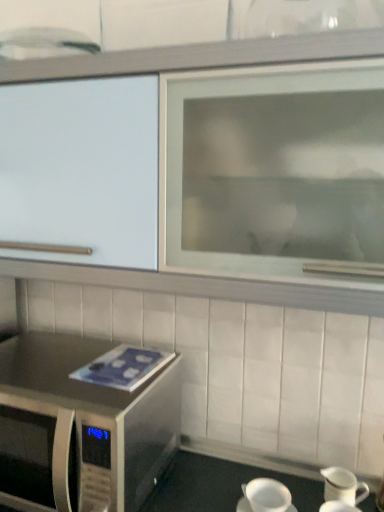
Question: Could white glossy pitcher at lower right, positioned as the second tableware in front-to-back order, be considered to be inside white glossy cabinet at upper center?

Choices:
 (A) yes
 (B) no

Answer: (B)

Question: Does white glossy cabinet at upper center have a larger size compared to white glossy pitcher at lower right, arranged as the 1th tableware when viewed from the back?

Choices:
 (A) yes
 (B) no

Answer: (A)

Question: Considering the relative sizes of white glossy cabinet at upper center and white glossy pitcher at lower right, arranged as the 1th tableware when viewed from the back, in the image provided, is white glossy cabinet at upper center wider than white glossy pitcher at lower right, arranged as the 1th tableware when viewed from the back,?

Choices:
 (A) no
 (B) yes

Answer: (B)

Question: From a real-world perspective, is white glossy cabinet at upper center located higher than white glossy pitcher at lower right, arranged as the 1th tableware when viewed from the back?

Choices:
 (A) yes
 (B) no

Answer: (A)

Question: Would you say white glossy cabinet at upper center is a long distance from white glossy pitcher at lower right, arranged as the 1th tableware when viewed from the back?

Choices:
 (A) no
 (B) yes

Answer: (A)

Question: Looking at the image, does white matte coffee cup at lower center seem bigger or smaller compared to white glossy pitcher at lower right, the 1th tableware positioned from the front?

Choices:
 (A) big
 (B) small

Answer: (B)

Question: Looking at their shapes, would you say white matte coffee cup at lower center is wider or thinner than white glossy pitcher at lower right, the 1th tableware positioned from the front?

Choices:
 (A) thin
 (B) wide

Answer: (B)

Question: Is point (243, 484) closer or farther from the camera than point (345, 507)?

Choices:
 (A) closer
 (B) farther

Answer: (B)

Question: From a real-world perspective, is white matte coffee cup at lower center above or below white glossy pitcher at lower right, positioned as the second tableware in back-to-front order?

Choices:
 (A) above
 (B) below

Answer: (B)

Question: Looking at their shapes, would you say white glossy cabinet at upper center is wider or thinner than white matte coffee cup at lower center?

Choices:
 (A) wide
 (B) thin

Answer: (A)

Question: Considering their positions, is white glossy cabinet at upper center located in front of or behind white matte coffee cup at lower center?

Choices:
 (A) behind
 (B) front

Answer: (B)

Question: Based on their positions, is white glossy cabinet at upper center located to the left or right of white matte coffee cup at lower center?

Choices:
 (A) right
 (B) left

Answer: (B)

Question: From the image's perspective, is white glossy cabinet at upper center above or below white matte coffee cup at lower center?

Choices:
 (A) above
 (B) below

Answer: (A)

Question: From a real-world perspective, is white glossy pitcher at lower right, positioned as the second tableware in front-to-back order, above or below stainless steel microwave at lower left?

Choices:
 (A) below
 (B) above

Answer: (A)

Question: Considering the positions of white glossy pitcher at lower right, positioned as the second tableware in front-to-back order, and stainless steel microwave at lower left in the image, is white glossy pitcher at lower right, positioned as the second tableware in front-to-back order, taller or shorter than stainless steel microwave at lower left?

Choices:
 (A) short
 (B) tall

Answer: (A)